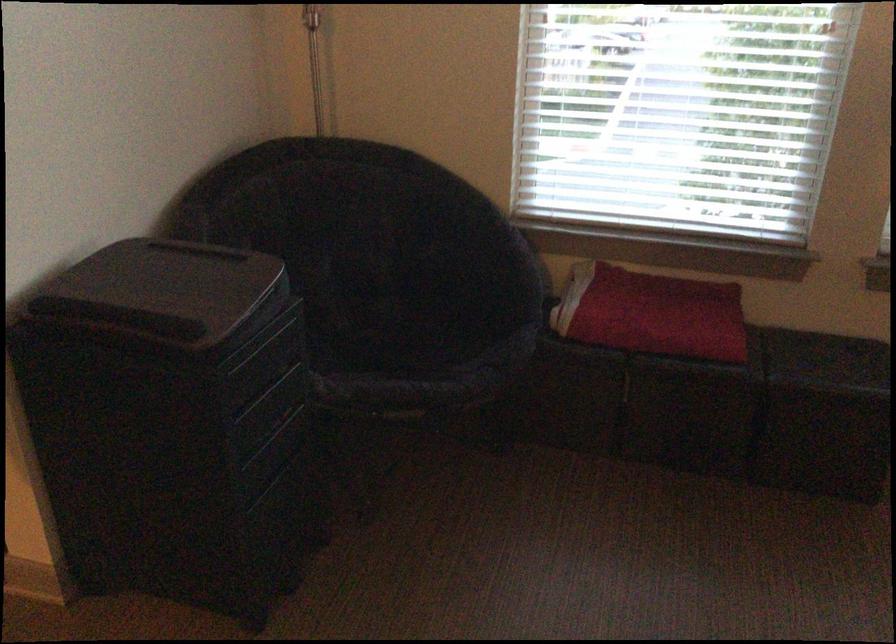
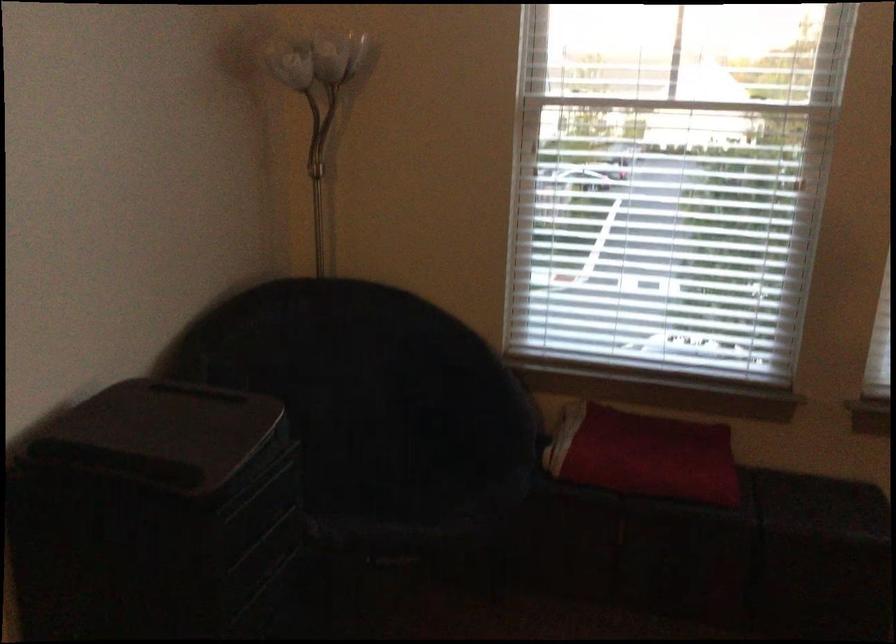
In a continuous first-person perspective shot, in which direction is the camera moving?

The cameraman walked toward left, backward.